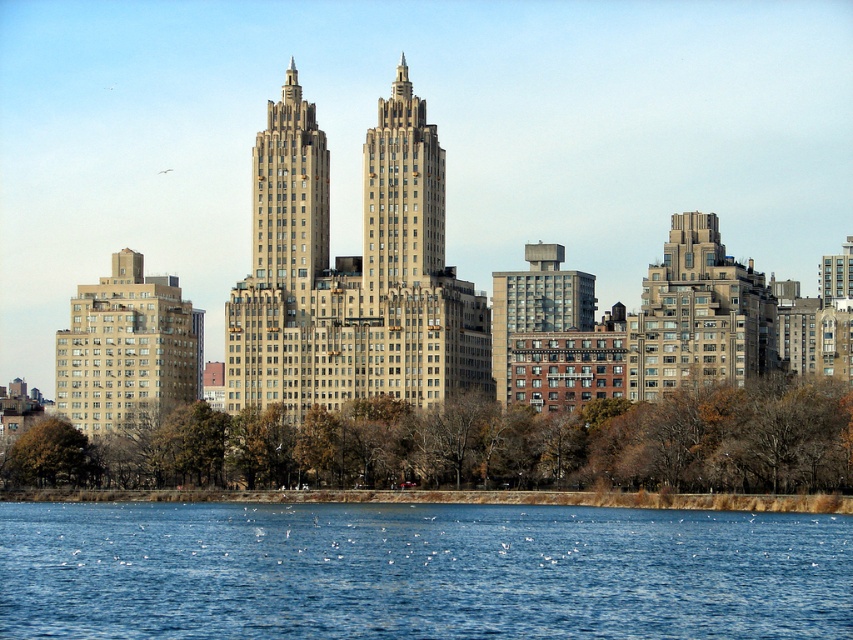
Question: Which of these objects is positioned farthest from the beige stone twin towers at center?

Choices:
 (A) blue liquid water at lower center
 (B) brown brick building at center
 (C) beige concrete building at left

Answer: (A)

Question: Which point appears closest to the camera in this image?

Choices:
 (A) (518, 326)
 (B) (154, 620)

Answer: (B)

Question: Can you confirm if beige stone twin towers at center is wider than beige concrete building at left?

Choices:
 (A) no
 (B) yes

Answer: (B)

Question: Which is farther from the beige stone twin towers at center?

Choices:
 (A) blue liquid water at lower center
 (B) brown brick building at center
 (C) beige concrete building at left

Answer: (A)

Question: Observing the image, what is the correct spatial positioning of blue liquid water at lower center in reference to beige stone twin towers at center?

Choices:
 (A) above
 (B) below

Answer: (B)

Question: Does beige stone twin towers at center appear under brown brick building at center?

Choices:
 (A) no
 (B) yes

Answer: (A)